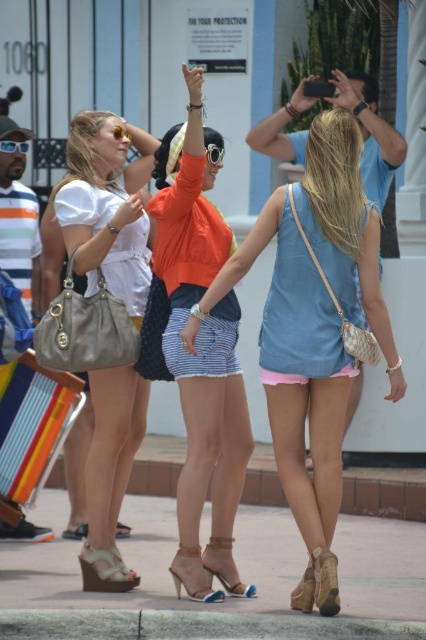
Question: Is beige suede sandal at lower center further to the viewer compared to brown suede sandal at lower right?

Choices:
 (A) yes
 (B) no

Answer: (A)

Question: Which object is positioned farthest from the leather high-heeled sandal at center?

Choices:
 (A) orange fabric skirt at center
 (B) denim tank top at center
 (C) leather wedge sandal at lower center

Answer: (B)

Question: Is denim tank top at center positioned in front of beige suede sandal at lower center?

Choices:
 (A) no
 (B) yes

Answer: (A)

Question: Which point appears closest to the camera in this image?

Choices:
 (A) (311, 570)
 (B) (267, 136)
 (C) (207, 152)

Answer: (A)

Question: Considering the real-world distances, which object is closest to the smooth concrete pavement at lower center?

Choices:
 (A) shiny beige sandal at lower center
 (B) leather wedge sandal at lower center

Answer: (A)

Question: Does brown suede sandal at lower right appear under shiny beige sandal at lower center?

Choices:
 (A) no
 (B) yes

Answer: (A)